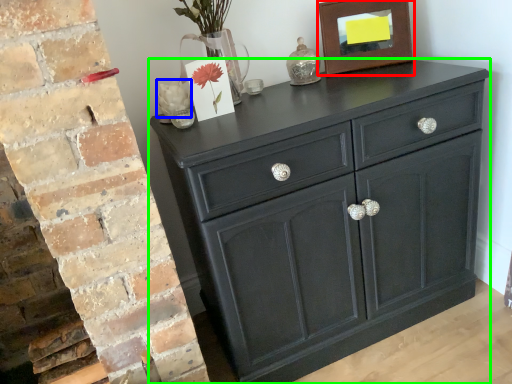
Question: Considering the real-world distances, which object is closest to picture frame (highlighted by a red box)? flower (highlighted by a blue box) or chest of drawers (highlighted by a green box).

Choices:
 (A) flower
 (B) chest of drawers

Answer: (B)